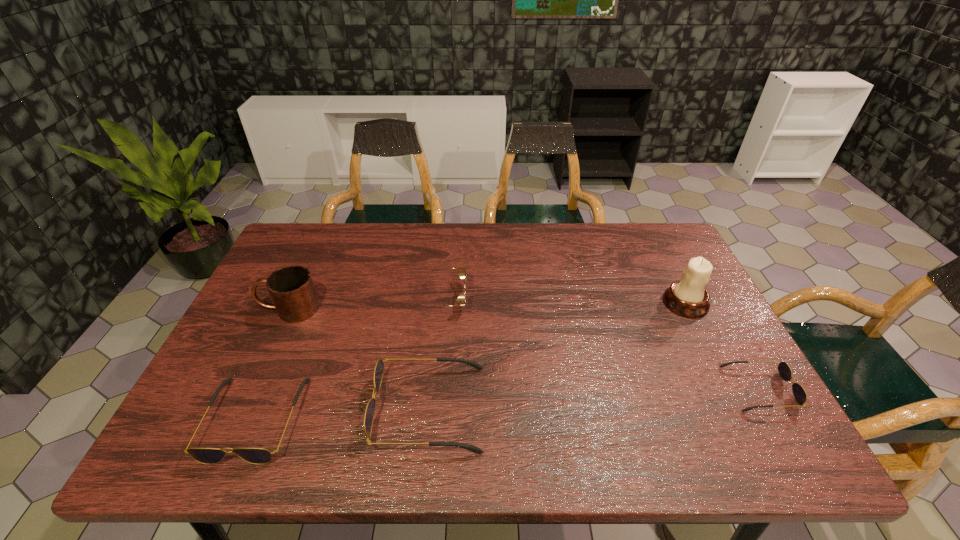
In order to click on the fifth tallest object in this screenshot , I will do (209, 456).

Find the location of `the third tallest sunglasses`. the third tallest sunglasses is located at coordinates (209, 456).

The image size is (960, 540). In order to click on the shortest object in this screenshot , I will do `click(785, 372)`.

Locate an element on the screen. the rightmost sunglasses is located at coordinates (x=785, y=372).

At what (x,y) coordinates should I click in order to perform the action: click on the farthest sunglasses. Please return your answer as a coordinate pair (x, y). The width and height of the screenshot is (960, 540). Looking at the image, I should click on (461, 270).

You are a GUI agent. You are given a task and a screenshot of the screen. Output one action in this format:
    pyautogui.click(x=<x>, y=<y>)
    Task: Click on the mug
    
    Given the screenshot: What is the action you would take?
    pyautogui.click(x=291, y=288)

Where is `the tallest object`? The image size is (960, 540). the tallest object is located at coordinates (687, 297).

You are a GUI agent. You are given a task and a screenshot of the screen. Output one action in this format:
    pyautogui.click(x=<x>, y=<y>)
    Task: Click on the free location located 0.130m on the front lenses of the farthest sunglasses
    The image size is (960, 540).
    Given the screenshot: What is the action you would take?
    pyautogui.click(x=512, y=299)

Find the location of a particular element. The height and width of the screenshot is (540, 960). free space located on the front of the tallest object is located at coordinates (728, 386).

The image size is (960, 540). I want to click on sunglasses that is positioned at the left edge, so click(x=209, y=456).